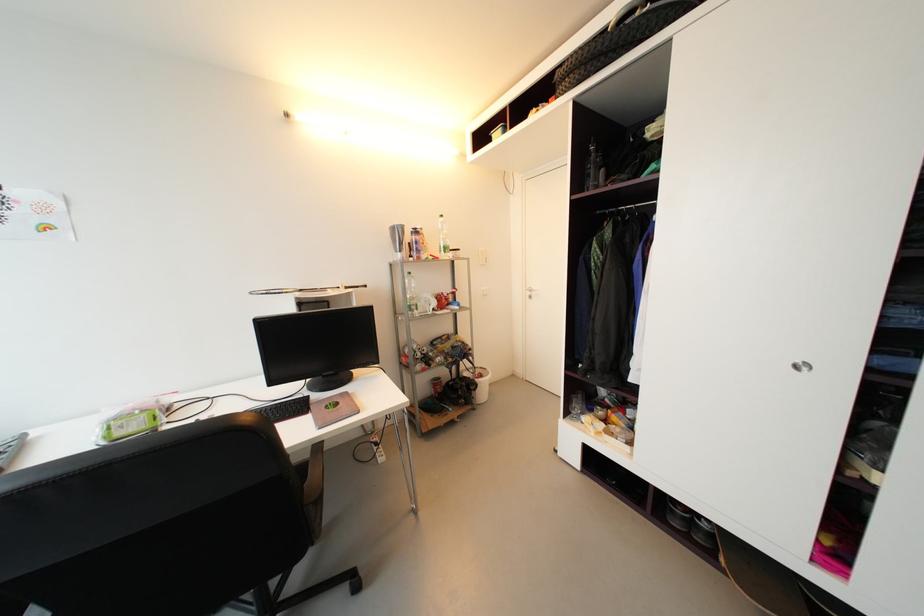
Where is `silver door handle`? Image resolution: width=924 pixels, height=616 pixels. silver door handle is located at coordinates (535, 296).